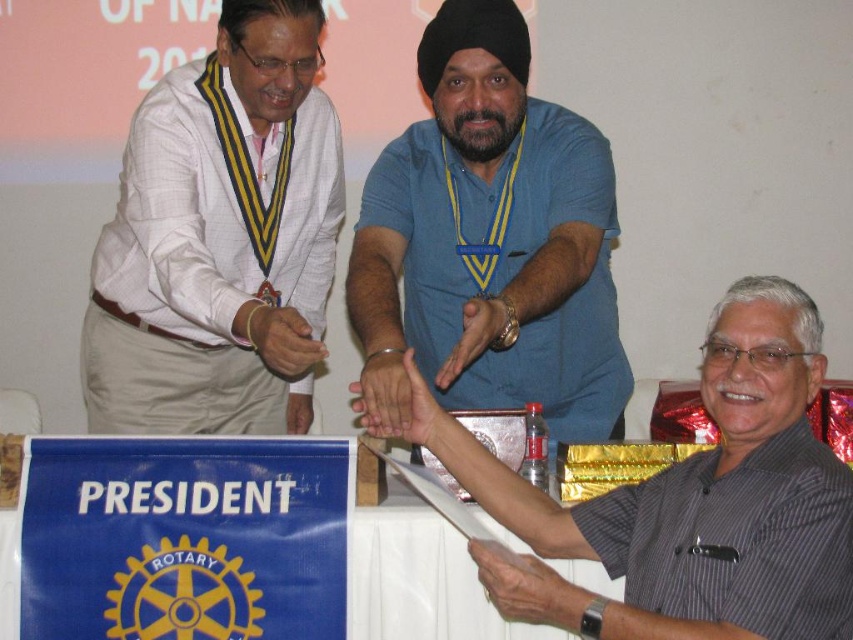
Question: Based on their relative distances, which object is farther from the blue cotton shirt at center?

Choices:
 (A) gray striped shirt at center
 (B) white textured shirt at left

Answer: (B)

Question: Which object is positioned farthest from the blue cotton shirt at center?

Choices:
 (A) white textured shirt at left
 (B) gray striped shirt at center

Answer: (A)

Question: Estimate the real-world distances between objects in this image. Which object is closer to the white textured shirt at left?

Choices:
 (A) blue cotton shirt at center
 (B) gray striped shirt at center

Answer: (A)

Question: Is white textured shirt at left to the left of gray striped shirt at center from the viewer's perspective?

Choices:
 (A) yes
 (B) no

Answer: (A)

Question: Does blue cotton shirt at center have a smaller size compared to gray striped shirt at center?

Choices:
 (A) no
 (B) yes

Answer: (A)

Question: Is white textured shirt at left smaller than gray striped shirt at center?

Choices:
 (A) yes
 (B) no

Answer: (B)